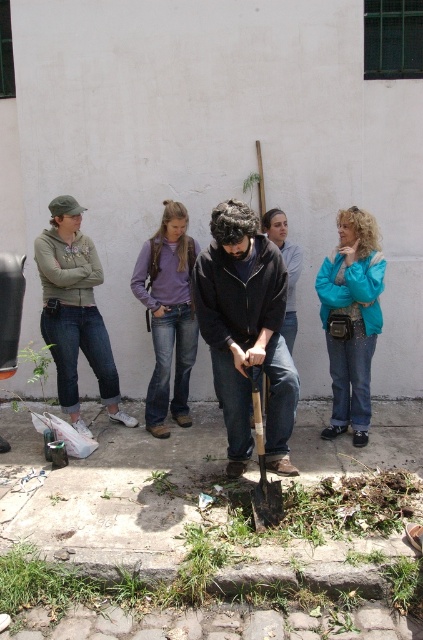
Does dark brown leather jacket at center have a greater height compared to green leafy plant at lower left?

Yes, dark brown leather jacket at center is taller than green leafy plant at lower left.

Who is positioned more to the left, dark brown leather jacket at center or green leafy plant at lower left?

green leafy plant at lower left

This screenshot has height=640, width=423. Describe the element at coordinates (247, 332) in the screenshot. I see `dark brown leather jacket at center` at that location.

At what (x,y) coordinates should I click in order to perform the action: click on dark brown leather jacket at center. Please return your answer as a coordinate pair (x, y). Image resolution: width=423 pixels, height=640 pixels. Looking at the image, I should click on (247, 332).

Does wooden shovel at center appear on the left side of green leafy plant at lower left?

In fact, wooden shovel at center is to the right of green leafy plant at lower left.

Between point (264, 513) and point (40, 355), which one is positioned in front?

Point (264, 513)

Where is `wooden shovel at center`? The height and width of the screenshot is (640, 423). wooden shovel at center is located at coordinates (263, 467).

Who is more forward, (269, 342) or (359, 275)?

Point (269, 342) is more forward.

Between dark brown leather jacket at center and turquoise fabric jacket at right, which one appears on the left side from the viewer's perspective?

Positioned to the left is dark brown leather jacket at center.

Which is in front, point (274, 336) or point (348, 307)?

Point (274, 336) is in front.

Image resolution: width=423 pixels, height=640 pixels. Identify the location of dark brown leather jacket at center. (247, 332).